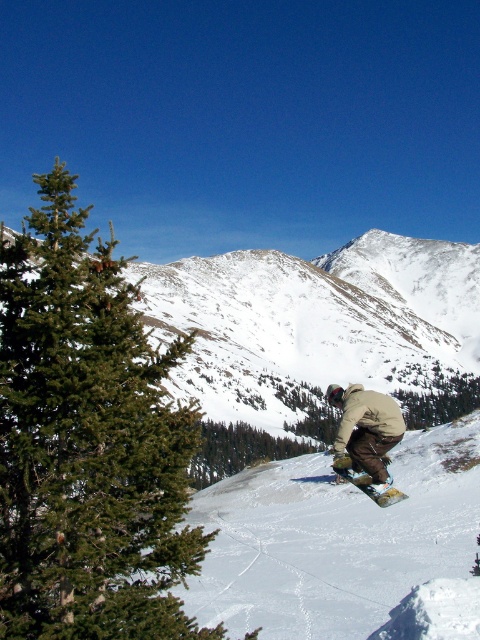
Question: In this image, where is snowy mountain at center located relative to tan fabric snowboarder at center?

Choices:
 (A) above
 (B) below

Answer: (A)

Question: Among these objects, which one is nearest to the camera?

Choices:
 (A) snowy mountain at center
 (B) tan fabric snowboarder at center
 (C) green matte tree at center

Answer: (B)

Question: Which of the following is the closest to the observer?

Choices:
 (A) green matte tree at lower center
 (B) green evergreen tree at left
 (C) green matte tree at center
 (D) snowy mountain at center

Answer: (B)

Question: Does tan fabric snowboarder at center come behind green matte tree at lower center?

Choices:
 (A) no
 (B) yes

Answer: (A)

Question: Can you confirm if green evergreen tree at left is bigger than green matte tree at lower center?

Choices:
 (A) yes
 (B) no

Answer: (A)

Question: Among these points, which one is farthest from the camera?

Choices:
 (A) (206, 435)
 (B) (404, 408)
 (C) (344, 480)

Answer: (B)